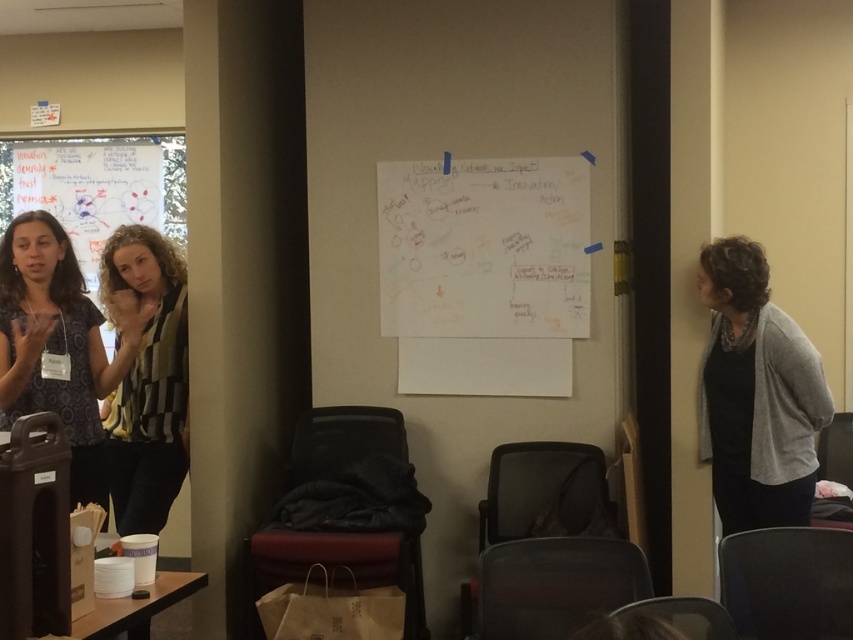
Question: Which object is the farthest from the patterned fabric shirt at left?

Choices:
 (A) dark fabric chair at lower center
 (B) black leather chair at lower right
 (C) gray fabric chair at lower right
 (D) black checkered shirt at center

Answer: (B)

Question: Based on their relative distances, which object is nearer to the mesh fabric chair at center?

Choices:
 (A) gray wool sweater at right
 (B) white paper at center
 (C) black checkered shirt at center
 (D) dark fabric chair at lower center

Answer: (A)

Question: Among these points, which one is farthest from the camera?

Choices:
 (A) (358, 532)
 (B) (589, 468)

Answer: (B)

Question: Is black leather chair at lower right to the right of dark gray fabric chair at lower right from the viewer's perspective?

Choices:
 (A) no
 (B) yes

Answer: (A)

Question: Can you confirm if black leather chair at lower right is bigger than dark gray fabric chair at lower right?

Choices:
 (A) no
 (B) yes

Answer: (A)

Question: Considering the relative positions of black checkered shirt at center and black leather chair at lower right in the image provided, where is black checkered shirt at center located with respect to black leather chair at lower right?

Choices:
 (A) left
 (B) right

Answer: (A)